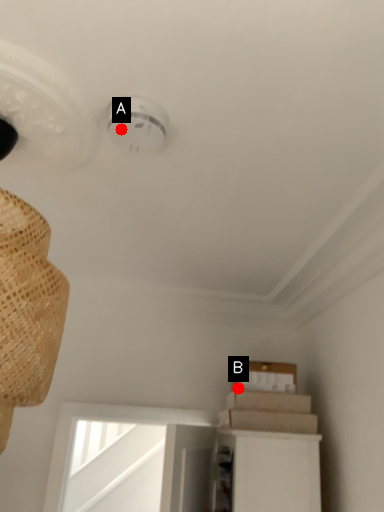
Question: Two points are circled on the image, labeled by A and B beside each circle. Among these points, which one is farthest from the camera?

Choices:
 (A) A is further
 (B) B is further

Answer: (B)